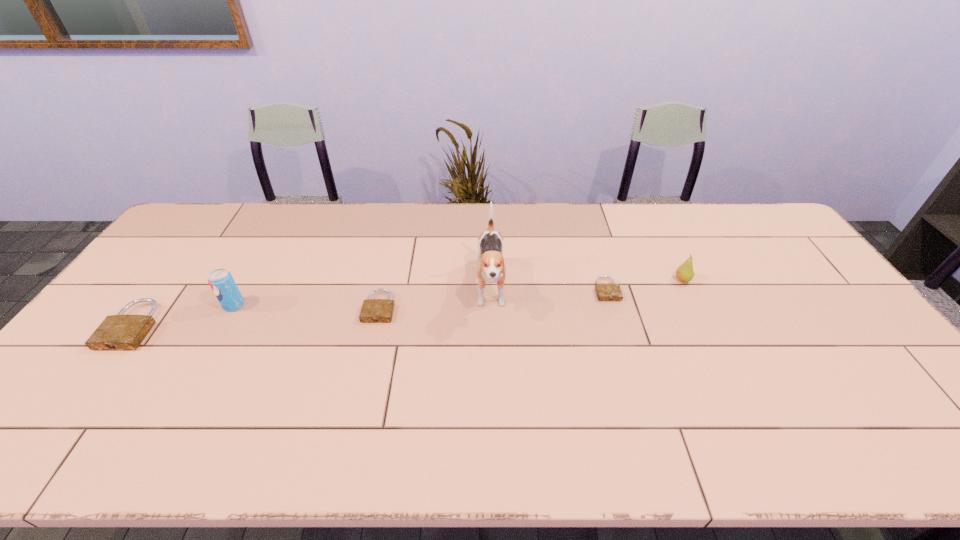
I want to click on free space that is in between the second padlock from left to right and the puppy, so click(x=435, y=298).

Find the location of a particular element. free space between the second padlock from left to right and the tallest object is located at coordinates (435, 298).

Find the location of a particular element. The width and height of the screenshot is (960, 540). vacant point located between the second padlock from left to right and the second tallest object is located at coordinates (307, 306).

In order to click on free point between the rightmost object and the second tallest padlock in this screenshot , I will do tap(531, 293).

Where is `object that stands as the second closest to the tallest padlock`? The image size is (960, 540). object that stands as the second closest to the tallest padlock is located at coordinates (373, 310).

Locate an element on the screen. the second closest object to the pear is located at coordinates (491, 268).

Choose which padlock is the second nearest neighbor to the tallest object. Please provide its 2D coordinates. Your answer should be formatted as a tuple, i.e. [(x, y)], where the tuple contains the x and y coordinates of a point satisfying the conditions above.

[(606, 291)]

Select which padlock is the closest to the shortest padlock. Please provide its 2D coordinates. Your answer should be formatted as a tuple, i.e. [(x, y)], where the tuple contains the x and y coordinates of a point satisfying the conditions above.

[(373, 310)]